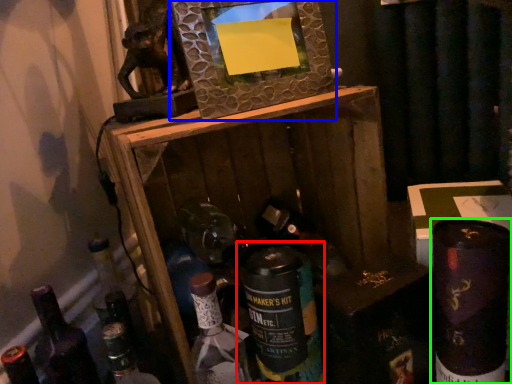
Question: Which object is the farthest from bottle (highlighted by a red box)? Choose among these: picture frame (highlighted by a blue box) or bottle (highlighted by a green box).

Choices:
 (A) picture frame
 (B) bottle

Answer: (A)